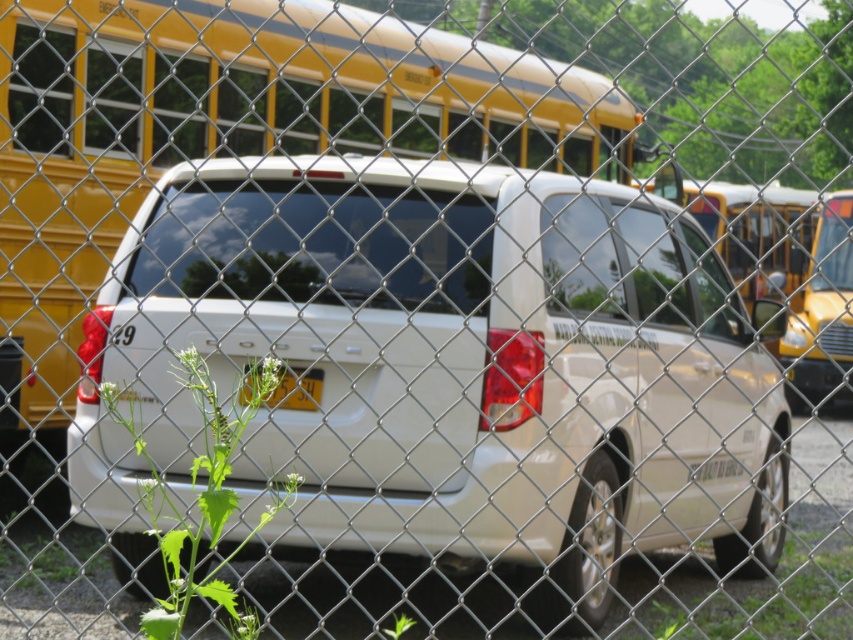
In the scene shown: Between green leafy plant at lower left and yellow plastic license plate at center, which one appears on the left side from the viewer's perspective?

green leafy plant at lower left

Can you confirm if green leafy plant at lower left is positioned above yellow plastic license plate at center?

No, green leafy plant at lower left is not above yellow plastic license plate at center.

The width and height of the screenshot is (853, 640). Identify the location of green leafy plant at lower left. (201, 492).

From the picture: Which of these two, yellow matte bus at upper left or yellow plastic license plate at center, stands taller?

With more height is yellow matte bus at upper left.

Measure the distance between yellow matte bus at upper left and yellow plastic license plate at center.

7.42 meters

Between point (425, 134) and point (265, 404), which one is positioned in front?

Positioned in front is point (265, 404).

Locate an element on the screen. The height and width of the screenshot is (640, 853). yellow matte bus at upper left is located at coordinates (233, 131).

Which is below, yellow matte/satin school bus at center or green leafy plant at lower left?

green leafy plant at lower left

Between yellow matte/satin school bus at center and green leafy plant at lower left, which one has less height?

With less height is green leafy plant at lower left.

Is point (807, 214) less distant than point (254, 388)?

No, it is behind (254, 388).

Find the location of a particular element. yellow matte/satin school bus at center is located at coordinates (781, 275).